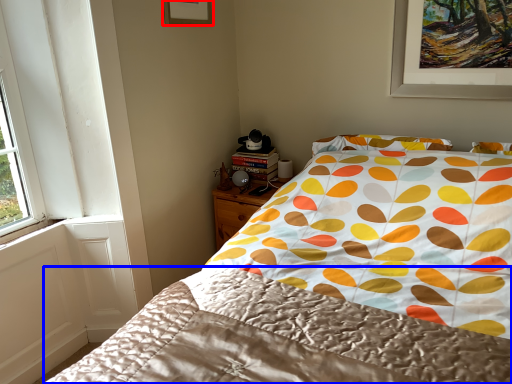
Question: Among these objects, which one is farthest to the camera, picture frame (highlighted by a red box) or blanket (highlighted by a blue box)?

Choices:
 (A) picture frame
 (B) blanket

Answer: (A)